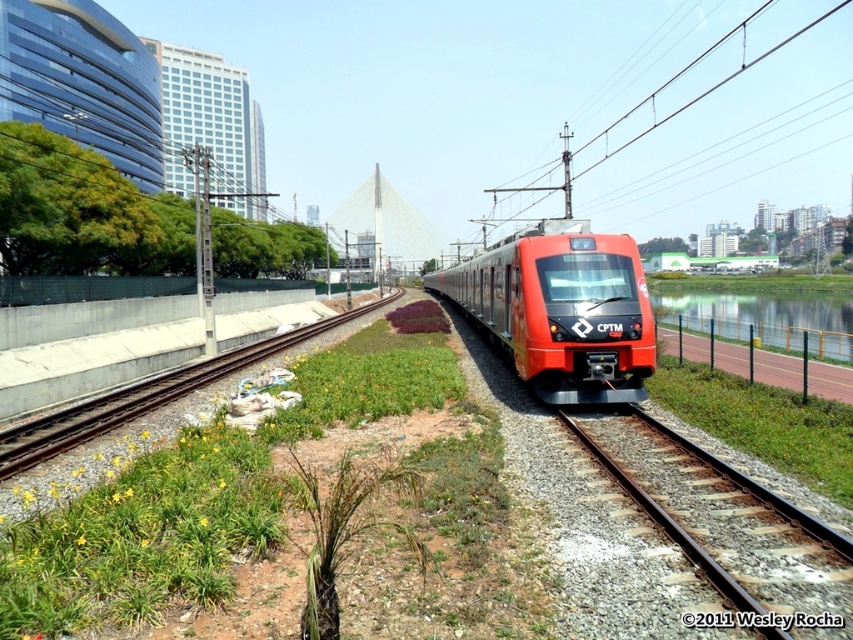
Question: Which point is farther to the camera?

Choices:
 (A) (782, 298)
 (B) (27, 456)
 (C) (570, 310)

Answer: (A)

Question: Which object is the farthest from the shiny orange train at center?

Choices:
 (A) green water at right
 (B) concrete at left

Answer: (A)

Question: Which object is the closest to the shiny orange train at center?

Choices:
 (A) concrete at left
 (B) green water at right

Answer: (A)

Question: From the image, what is the correct spatial relationship of concrete at left in relation to green water at right?

Choices:
 (A) left
 (B) right

Answer: (A)

Question: From the image, what is the correct spatial relationship of concrete at left in relation to green water at right?

Choices:
 (A) above
 (B) below

Answer: (B)

Question: Is concrete at left thinner than green water at right?

Choices:
 (A) no
 (B) yes

Answer: (B)